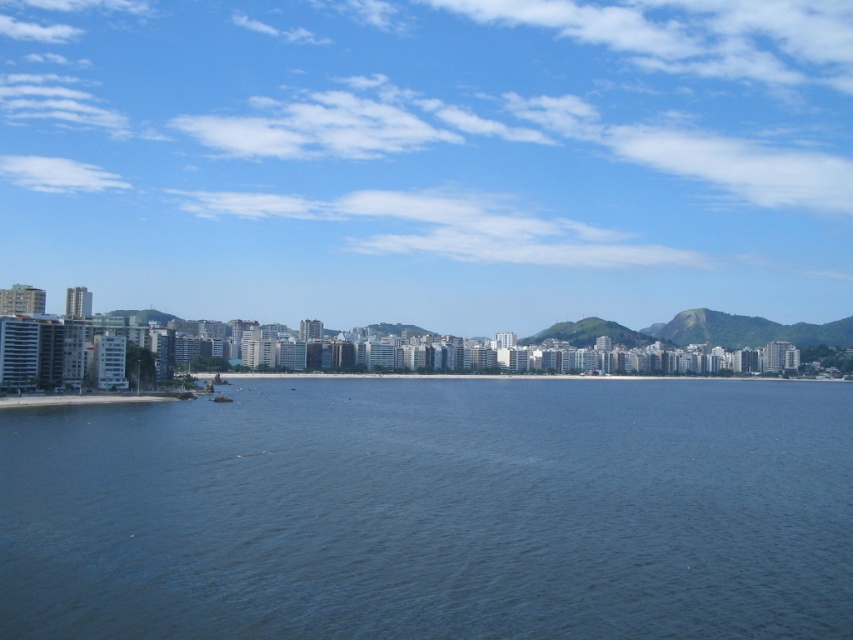
Is blue liquid water at center in front of gray concrete shoreline at lower left?

Yes.

Which is more to the right, blue liquid water at center or gray concrete shoreline at lower left?

Positioned to the right is blue liquid water at center.

Is point (526, 426) positioned after point (64, 396)?

No, it is in front of (64, 396).

Where is `blue liquid water at center`? Image resolution: width=853 pixels, height=640 pixels. blue liquid water at center is located at coordinates (434, 509).

Locate an element on the screen. blue sky at upper center is located at coordinates (430, 157).

Who is lower down, blue sky at upper center or gray concrete shoreline at lower left?

gray concrete shoreline at lower left is below.

This screenshot has width=853, height=640. I want to click on blue sky at upper center, so click(430, 157).

Does blue sky at upper center appear under blue liquid water at center?

Incorrect, blue sky at upper center is not positioned below blue liquid water at center.

Does blue sky at upper center have a larger size compared to blue liquid water at center?

Indeed, blue sky at upper center has a larger size compared to blue liquid water at center.

Between point (126, 211) and point (534, 429), which one is positioned behind?

The point (126, 211) is behind.

You are a GUI agent. You are given a task and a screenshot of the screen. Output one action in this format:
    pyautogui.click(x=<x>, y=<y>)
    Task: Click on the blue sky at upper center
    
    Given the screenshot: What is the action you would take?
    pyautogui.click(x=430, y=157)